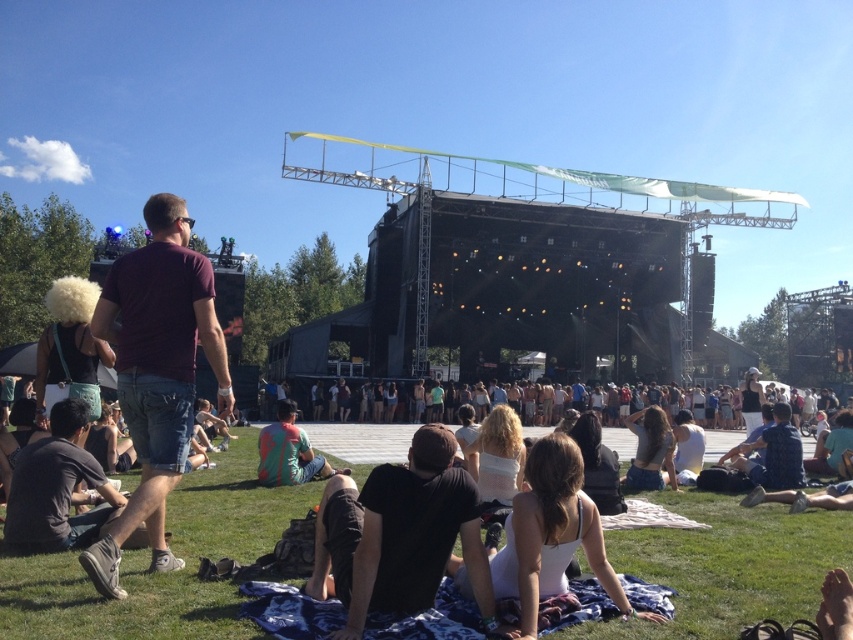
You are a photographer trying to capture a photo of the green grass at lower center and denim shorts at lower right. Which object appears taller in the photo?

The denim shorts at lower right appear taller than the green grass at lower center in the photo.